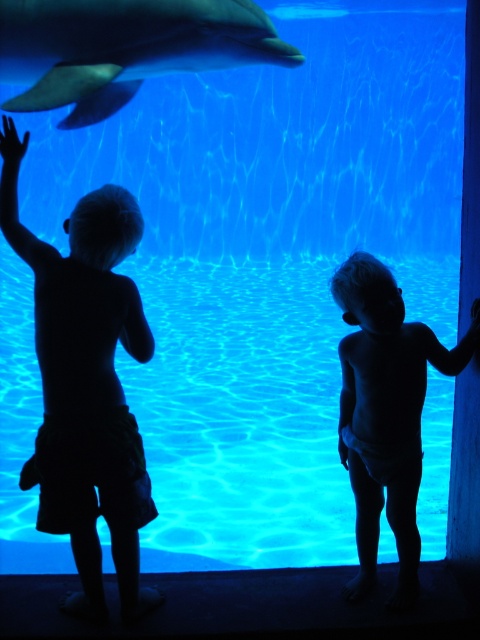
Question: Is silhouette shorts at left positioned before smooth gray dolphin at upper center?

Choices:
 (A) yes
 (B) no

Answer: (A)

Question: In this image, where is smooth gray dolphin at upper center located relative to silhouette diaper at right?

Choices:
 (A) below
 (B) above

Answer: (B)

Question: Does smooth gray dolphin at upper center come behind silhouette diaper at right?

Choices:
 (A) yes
 (B) no

Answer: (A)

Question: Which is nearer to the silhouette shorts at left?

Choices:
 (A) silhouette diaper at right
 (B) smooth gray dolphin at upper center

Answer: (A)

Question: Estimate the real-world distances between objects in this image. Which object is closer to the smooth gray dolphin at upper center?

Choices:
 (A) silhouette diaper at right
 (B) silhouette shorts at left

Answer: (B)

Question: Which object is farther from the camera taking this photo?

Choices:
 (A) silhouette shorts at left
 (B) smooth gray dolphin at upper center

Answer: (B)